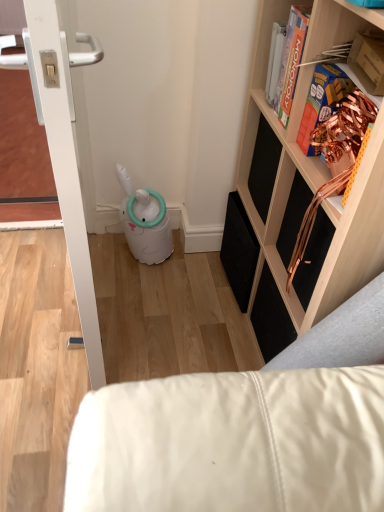
Find the location of a particular element. Image resolution: width=384 pixels, height=512 pixels. free space to the left of white glossy door at left is located at coordinates (32, 286).